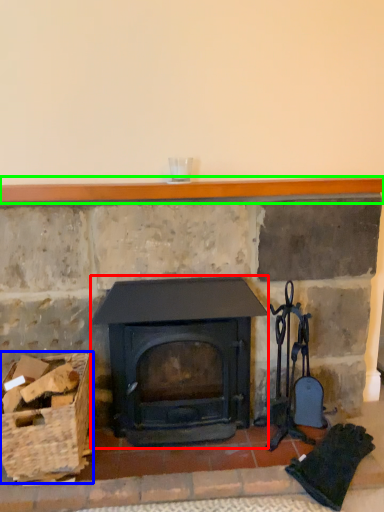
Question: Considering the real-world distances, which object is farthest from wood burning stove (highlighted by a red box)? basket (highlighted by a blue box) or balustrade (highlighted by a green box)?

Choices:
 (A) basket
 (B) balustrade

Answer: (B)